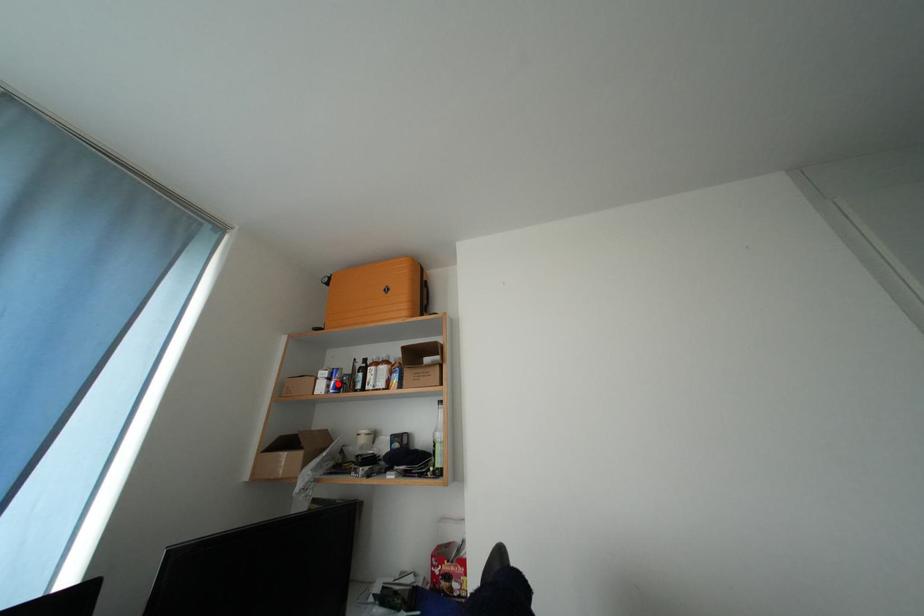
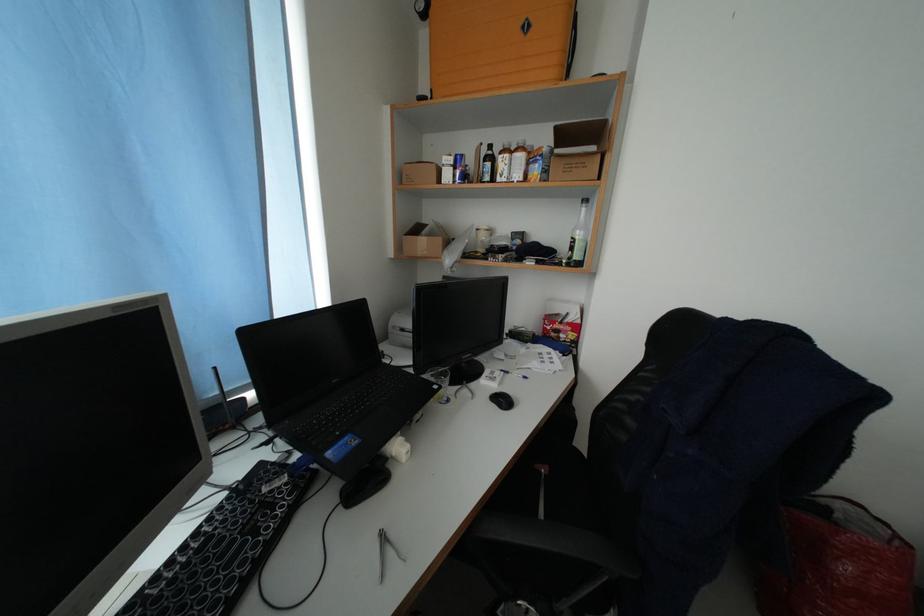
Where in the second image is the point corresponding to the highlighted location from the first image?

(464, 172)